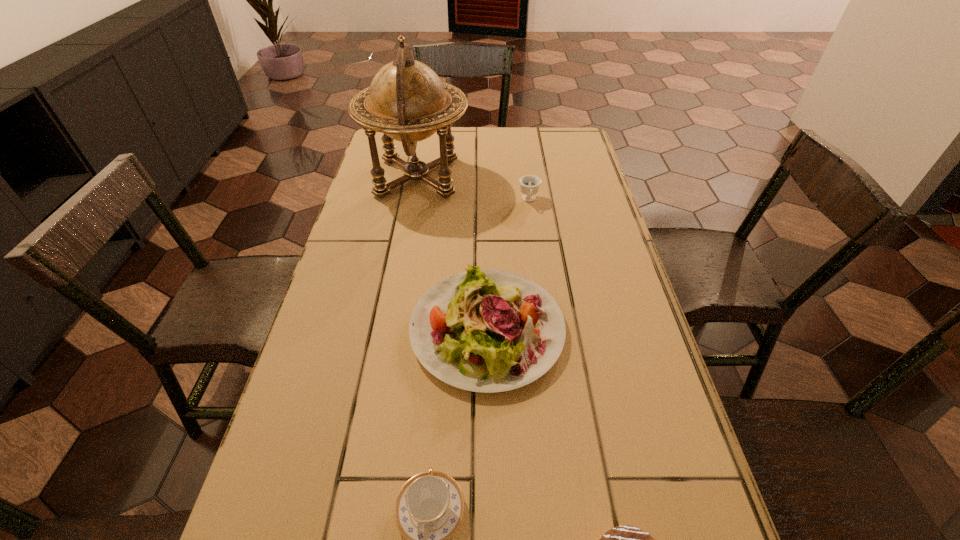
In the image, there is a desktop. Where is `vacant area at the far edge`? This screenshot has height=540, width=960. vacant area at the far edge is located at coordinates (470, 143).

I want to click on vacant position at the left edge of the desktop, so click(x=372, y=190).

Image resolution: width=960 pixels, height=540 pixels. In order to click on vacant region at the right edge of the desktop in this screenshot , I will do `click(641, 330)`.

Image resolution: width=960 pixels, height=540 pixels. What are the coordinates of `free area in between the tallest object and the farther teacup` in the screenshot? It's located at (473, 188).

What are the coordinates of `empty space that is in between the right teacup and the second tallest object` in the screenshot? It's located at (508, 265).

At what (x,y) coordinates should I click in order to perform the action: click on object that is the second closest to the nearer teacup. Please return your answer as a coordinate pair (x, y). Looking at the image, I should click on (627, 539).

Point out which object is positioned as the third nearest to the second tallest object. Please provide its 2D coordinates. Your answer should be formatted as a tuple, i.e. [(x, y)], where the tuple contains the x and y coordinates of a point satisfying the conditions above.

[(529, 184)]

Image resolution: width=960 pixels, height=540 pixels. Identify the location of vacant space that satisfies the following two spatial constraints: 1. on the back side of the salad plate; 2. on the front-facing side of the globe. (485, 177).

Locate an element on the screen. The width and height of the screenshot is (960, 540). blank area in the image that satisfies the following two spatial constraints: 1. on the front-facing side of the globe; 2. on the right side of the third farthest object is located at coordinates (389, 329).